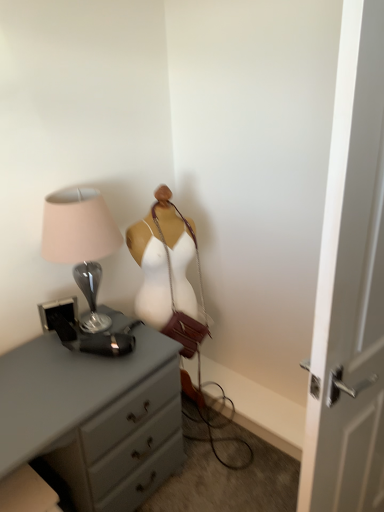
The image size is (384, 512). I want to click on vacant area that is in front of metallic glass lamp at left, so click(66, 379).